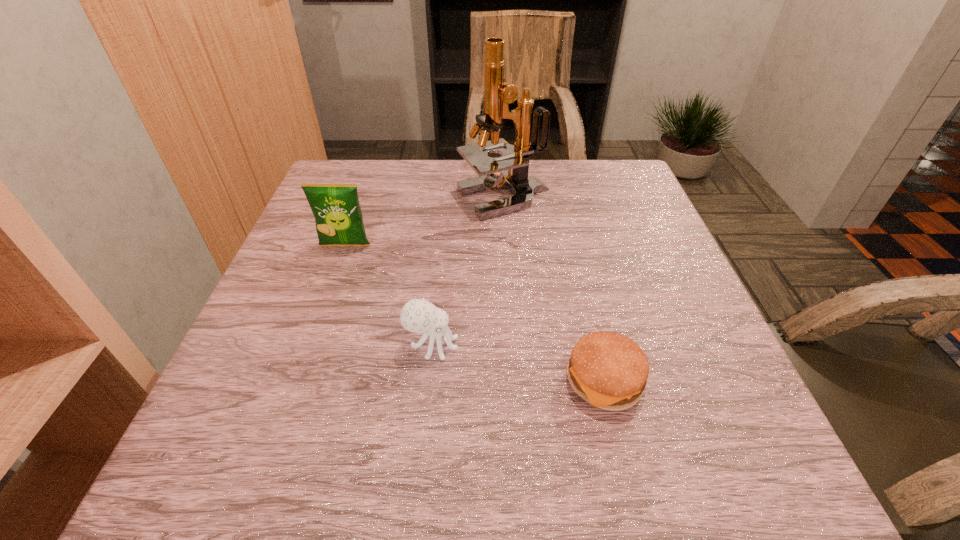
You are a GUI agent. You are given a task and a screenshot of the screen. Output one action in this format:
    pyautogui.click(x=<x>, y=<y>)
    Task: Click on the microscope
    
    Given the screenshot: What is the action you would take?
    pyautogui.click(x=499, y=94)

You are a GUI agent. You are given a task and a screenshot of the screen. Output one action in this format:
    pyautogui.click(x=<x>, y=<y>)
    Task: Click on the farthest object
    
    Given the screenshot: What is the action you would take?
    pyautogui.click(x=499, y=94)

Locate an element on the screen. crisp (potato chip) is located at coordinates (338, 217).

At what (x,y) coordinates should I click in order to perform the action: click on the third nearest object. Please return your answer as a coordinate pair (x, y). Looking at the image, I should click on (338, 217).

You are a GUI agent. You are given a task and a screenshot of the screen. Output one action in this format:
    pyautogui.click(x=<x>, y=<y>)
    Task: Click on the octopus
    
    Given the screenshot: What is the action you would take?
    pyautogui.click(x=419, y=316)

I want to click on hamburger, so click(x=608, y=370).

The width and height of the screenshot is (960, 540). I want to click on vacant space situated at the eyepiece of the microscope, so click(x=358, y=199).

This screenshot has width=960, height=540. Identify the location of vacant space situated at the eyepiece of the microscope. (381, 199).

In order to click on vacant region located 0.310m at the eyepiece of the microscope in this screenshot , I will do `click(334, 199)`.

The height and width of the screenshot is (540, 960). What are the coordinates of `vacant space located 0.100m on the front-facing side of the third shortest object` in the screenshot? It's located at [331, 284].